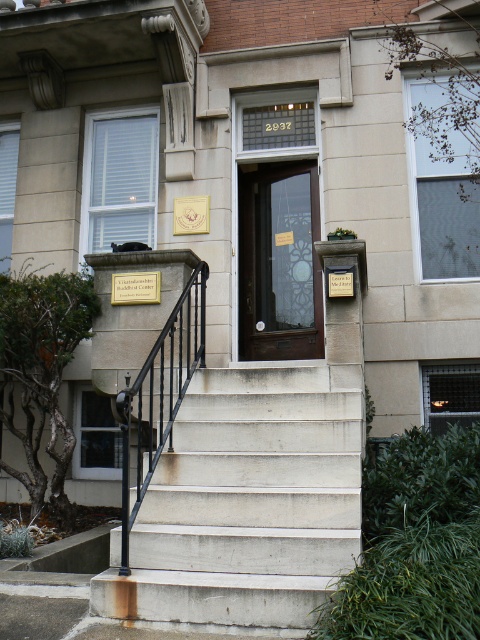
Is point (166, 353) positioned before point (147, 284)?

Yes, point (166, 353) is closer to viewer.

Based on the photo, can you confirm if black wrought iron railing at center is positioned above gold metallic plaque at center?

No, black wrought iron railing at center is not above gold metallic plaque at center.

What do you see at coordinates (158, 397) in the screenshot? I see `black wrought iron railing at center` at bounding box center [158, 397].

This screenshot has height=640, width=480. In order to click on black wrought iron railing at center in this screenshot , I will do `click(158, 397)`.

Between brown wooden door at center and black wrought iron railing at center, which one appears on the left side from the viewer's perspective?

black wrought iron railing at center is more to the left.

Does brown wooden door at center appear on the right side of black wrought iron railing at center?

Yes, brown wooden door at center is to the right of black wrought iron railing at center.

Based on the photo, who is more distant from viewer, (x=311, y=308) or (x=155, y=388)?

The point (x=311, y=308) is more distant.

Where is `brown wooden door at center`? Image resolution: width=480 pixels, height=640 pixels. brown wooden door at center is located at coordinates (278, 260).

Does concrete/stained stairs at lower center have a greater width compared to brown wooden door at center?

Yes.

Is concrete/stained stairs at lower center to the left of brown wooden door at center from the viewer's perspective?

Yes, concrete/stained stairs at lower center is to the left of brown wooden door at center.

Describe the element at coordinates (247, 500) in the screenshot. Image resolution: width=480 pixels, height=640 pixels. I see `concrete/stained stairs at lower center` at that location.

This screenshot has width=480, height=640. In order to click on concrete/stained stairs at lower center in this screenshot , I will do `click(247, 500)`.